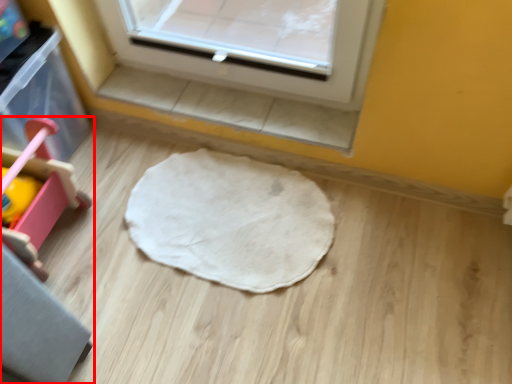
Question: From the image's perspective, what is the correct spatial relationship of furniture (annotated by the red box) in relation to mat?

Choices:
 (A) above
 (B) below

Answer: (A)